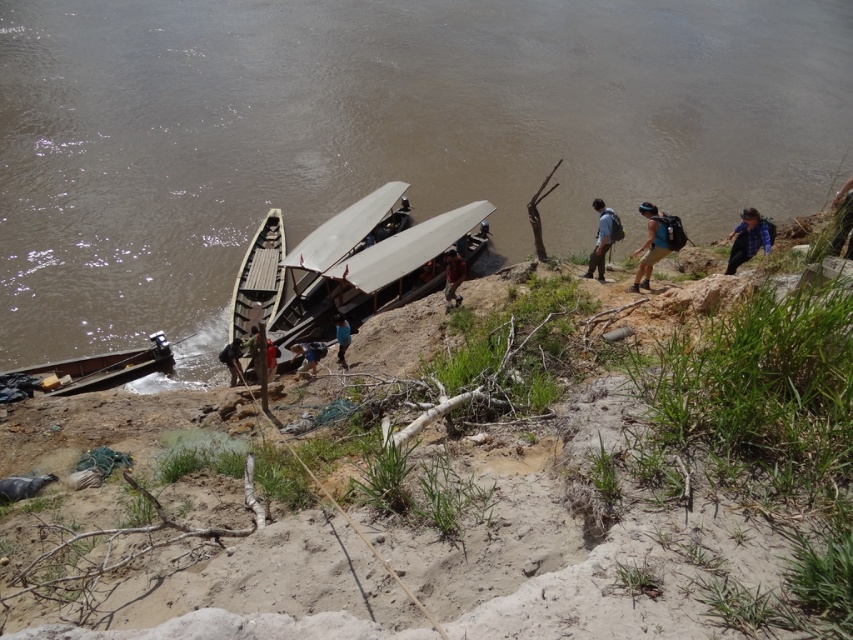
You are standing on the riverbank and want to cross to the other side. You see the brown muddy water at lower left and the wooden canoe at lower left. Which object is bigger in size and could potentially provide a stable surface for crossing?

The brown muddy water at lower left is larger in size compared to the wooden canoe at lower left. However, the wooden canoe at lower left is more suitable for crossing as muddy water may not provide a stable surface.

You are standing on the sandy and grassy riverbank and see the brown muddy water at lower left and the wooden canoe at lower left. Which object is positioned more to the left?

The wooden canoe at lower left is positioned more to the left since the brown muddy water at lower left is to the right of it.